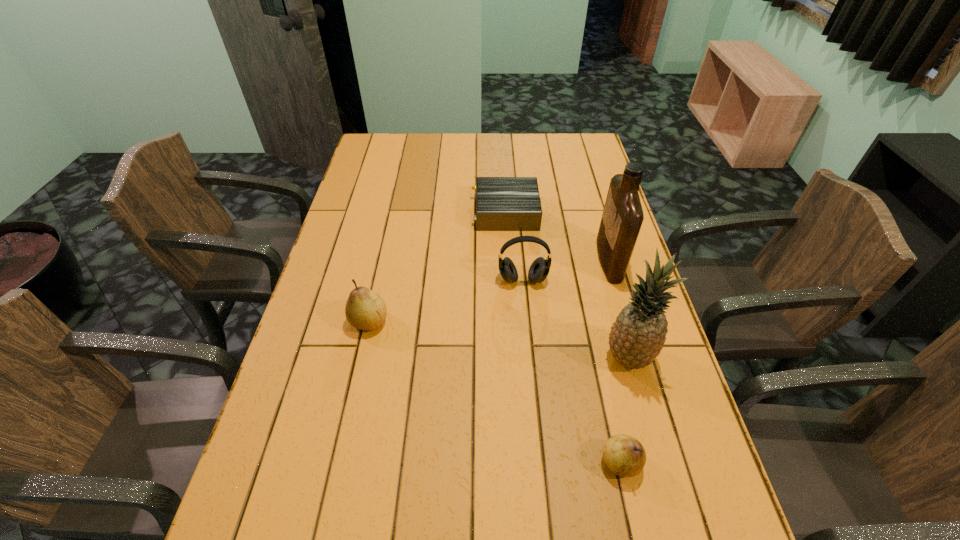
The width and height of the screenshot is (960, 540). What are the coordinates of `object at the left edge` in the screenshot? It's located at (365, 309).

You are a GUI agent. You are given a task and a screenshot of the screen. Output one action in this format:
    pyautogui.click(x=<x>, y=<y>)
    Task: Click on the pear that is at the right edge
    
    Given the screenshot: What is the action you would take?
    pyautogui.click(x=625, y=456)

The image size is (960, 540). Identify the location of liquor that is at the right edge. point(622,217).

Find the location of a particular element. This screenshot has height=540, width=960. pineapple at the right edge is located at coordinates (637, 337).

This screenshot has height=540, width=960. Find the location of `object at the near right corner`. object at the near right corner is located at coordinates (625, 456).

Locate an element on the screen. The width and height of the screenshot is (960, 540). vacant region at the far edge is located at coordinates (487, 156).

At what (x,y) coordinates should I click in order to perform the action: click on vacant area at the near edge. Please return your answer as a coordinate pair (x, y). This screenshot has height=540, width=960. Looking at the image, I should click on (496, 495).

You are a GUI agent. You are given a task and a screenshot of the screen. Output one action in this format:
    pyautogui.click(x=<x>, y=<y>)
    Task: Click on the vacant space at the left edge of the desktop
    Image resolution: width=960 pixels, height=540 pixels.
    Given the screenshot: What is the action you would take?
    pos(330,279)

This screenshot has height=540, width=960. I want to click on vacant region at the right edge of the desktop, so click(699, 455).

Image resolution: width=960 pixels, height=540 pixels. In order to click on free space at the near left corner in this screenshot , I will do `click(311, 506)`.